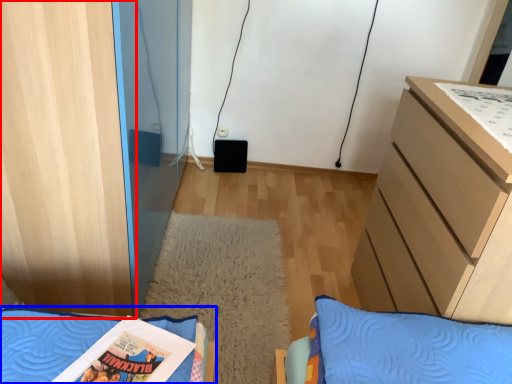
Question: Which object is closer to the camera taking this photo, cabinetry (highlighted by a red box) or furniture (highlighted by a blue box)?

Choices:
 (A) cabinetry
 (B) furniture

Answer: (B)